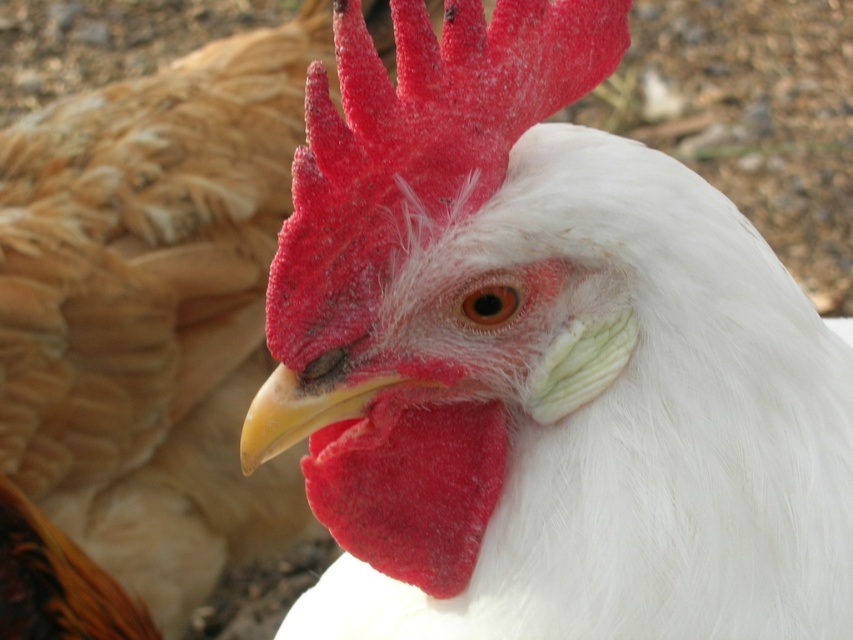
Between white feathered rooster at center and yellow beak at center, which one appears on the right side from the viewer's perspective?

Positioned to the right is white feathered rooster at center.

Which is behind, point (515, 227) or point (283, 432)?

The point (283, 432) is behind.

Find the location of a particular element. The width and height of the screenshot is (853, 640). white feathered rooster at center is located at coordinates (546, 358).